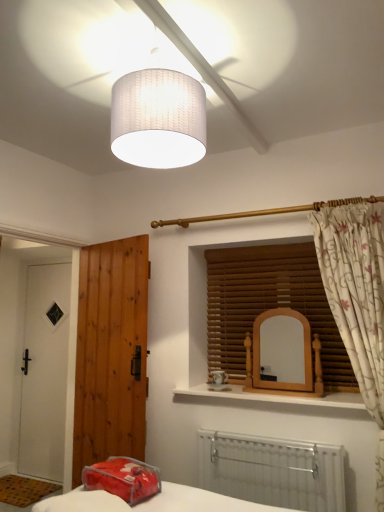
Locate an element on the screen. This screenshot has width=384, height=512. white metallic radiator at lower center is located at coordinates (272, 471).

What is the approximate height of wooden mirror at center?

wooden mirror at center is 21.90 inches in height.

In order to face translucent plastic pillow at lower center, should I rotate leftwards or rightwards?

Rotate left and turn 9.251 degrees.

Describe the element at coordinates (123, 478) in the screenshot. Image resolution: width=384 pixels, height=512 pixels. I see `translucent plastic pillow at lower center` at that location.

At what (x,y) coordinates should I click in order to perform the action: click on white matte door at left, which appears as the first door when viewed from the back. Please return your answer as a coordinate pair (x, y). Image resolution: width=384 pixels, height=512 pixels. Looking at the image, I should click on (45, 372).

Where is `white metallic radiator at lower center`? The image size is (384, 512). white metallic radiator at lower center is located at coordinates (272, 471).

How far apart are wooden blinds at center and wooden mirror at center?

10.05 inches.

Considering the relative sizes of wooden blinds at center and wooden mirror at center in the image provided, is wooden blinds at center thinner than wooden mirror at center?

Yes.

Is wooden blinds at center positioned beyond the bounds of wooden mirror at center?

Indeed, wooden blinds at center is completely outside wooden mirror at center.

Identify the location of medicine cabinet to the left of wooden blinds at center. (285, 354).

Are floral fabric curtain at right and wooden blinds at center far apart?

No.

Which of these two, floral fabric curtain at right or wooden blinds at center, stands taller?

floral fabric curtain at right.

From a real-world perspective, which object rests below the other?

From a 3D spatial view, floral fabric curtain at right is below.

How far apart are translucent plastic pillow at lower center and white matte door at left, marked as the 2th door in a front-to-back arrangement?

They are 6.94 feet apart.

From the image's perspective, between translucent plastic pillow at lower center and white matte door at left, which is the first door from left to right, who is located below?

white matte door at left, which is the first door from left to right, appears lower in the image.

Can you confirm if translucent plastic pillow at lower center is shorter than white matte door at left, marked as the 2th door in a front-to-back arrangement?

Correct, translucent plastic pillow at lower center is not as tall as white matte door at left, marked as the 2th door in a front-to-back arrangement.

Can you confirm if translucent plastic pillow at lower center is bigger than white matte door at left, which ranks as the second door in right-to-left order?

No, translucent plastic pillow at lower center is not bigger than white matte door at left, which ranks as the second door in right-to-left order.

Can you tell me how much floral fabric curtain at right and white metallic radiator at lower center differ in facing direction?

The angle between the facing direction of floral fabric curtain at right and the facing direction of white metallic radiator at lower center is 1.28 degrees.

Can you confirm if floral fabric curtain at right is wider than white metallic radiator at lower center?

Indeed, floral fabric curtain at right has a greater width compared to white metallic radiator at lower center.

Which of these two, floral fabric curtain at right or white metallic radiator at lower center, stands shorter?

With less height is white metallic radiator at lower center.

Considering the points (330, 215) and (277, 458), which point is in front, point (330, 215) or point (277, 458)?

The point (330, 215) is closer.

Does point (124, 457) come closer to viewer compared to point (260, 381)?

Yes.

Does translucent plastic pillow at lower center come behind wooden mirror at center?

No, it is not.

From the image's perspective, is translucent plastic pillow at lower center on top of wooden mirror at center?

Incorrect, from the image's perspective, translucent plastic pillow at lower center is lower than wooden mirror at center.

From the picture: Measure the distance between translucent plastic pillow at lower center and wooden mirror at center.

A distance of 1.16 meters exists between translucent plastic pillow at lower center and wooden mirror at center.

From a real-world perspective, is floral fabric curtain at right positioned above or below wooden mirror at center?

From a real-world perspective, floral fabric curtain at right is physically above wooden mirror at center.

Can you tell me how much floral fabric curtain at right and wooden mirror at center differ in facing direction?

There is a 2.55-degree angle between the facing directions of floral fabric curtain at right and wooden mirror at center.

Looking at this image, does floral fabric curtain at right turn towards wooden mirror at center?

No.

Considering the points (368, 264) and (268, 312), which point is in front, point (368, 264) or point (268, 312)?

The point (368, 264) is more forward.

Can you tell me how much white matte door at left, which appears as the first door when viewed from the back, and wooden mirror at center differ in facing direction?

There is a 1.69-degree angle between the facing directions of white matte door at left, which appears as the first door when viewed from the back, and wooden mirror at center.

From a real-world perspective, is white matte door at left, which is the first door from left to right, beneath wooden mirror at center?

Yes.

Can we say white matte door at left, which ranks as the second door in right-to-left order, lies outside wooden mirror at center?

Absolutely, white matte door at left, which ranks as the second door in right-to-left order, is external to wooden mirror at center.

In order to click on medicine cabinet on the left side of wooden blinds at center in this screenshot , I will do `click(285, 354)`.

You are a GUI agent. You are given a task and a screenshot of the screen. Output one action in this format:
    pyautogui.click(x=<x>, y=<y>)
    Task: Click on the curtain in front of the wooden blinds at center
    
    Given the screenshot: What is the action you would take?
    pyautogui.click(x=357, y=300)

From the image, which object appears to be farther from floral fabric curtain at right, wooden blinds at center or white textured lampshade at upper center?

Among the two, white textured lampshade at upper center is located further to floral fabric curtain at right.

Considering their positions, is white metallic radiator at lower center positioned further to floral fabric curtain at right than white matte door at left, which is the first door from left to right?

white matte door at left, which is the first door from left to right.

Looking at the image, which one is located closer to floral fabric curtain at right, white matte door at left, marked as the 2th door in a front-to-back arrangement, or wooden mirror at center?

The object closer to floral fabric curtain at right is wooden mirror at center.

When comparing their distances from translucent plastic pillow at lower center, does white metallic radiator at lower center or white matte door at left, which is the first door from left to right, seem further?

The object further to translucent plastic pillow at lower center is white matte door at left, which is the first door from left to right.

Based on their spatial positions, is brown wooden door at left, the 2th door positioned from the back, or translucent plastic pillow at lower center closer to white textured lampshade at upper center?

brown wooden door at left, the 2th door positioned from the back, is closer to white textured lampshade at upper center.

Estimate the real-world distances between objects in this image. Which object is further from wooden blinds at center, floral fabric curtain at right or brown wooden door at left, acting as the first door starting from the right?

brown wooden door at left, acting as the first door starting from the right, is further to wooden blinds at center.

Based on their spatial positions, is floral fabric curtain at right or white textured lampshade at upper center closer to wooden mirror at center?

floral fabric curtain at right lies closer to wooden mirror at center than the other object.

Considering their positions, is white textured lampshade at upper center positioned further to white metallic radiator at lower center than white matte door at left, which is the first door from left to right?

white textured lampshade at upper center is positioned further to the anchor white metallic radiator at lower center.

At what (x,y) coordinates should I click in order to perform the action: click on door between white matte door at left, which ranks as the second door in right-to-left order, and wooden mirror at center. Please return your answer as a coordinate pair (x, y). The width and height of the screenshot is (384, 512). Looking at the image, I should click on (111, 352).

Identify the location of curtain between white textured lampshade at upper center and wooden mirror at center from top to bottom. Image resolution: width=384 pixels, height=512 pixels. (357, 300).

Identify the location of window blind between white matte door at left, which appears as the first door when viewed from the back, and floral fabric curtain at right. (270, 305).

Locate an element on the screen. The width and height of the screenshot is (384, 512). radiator between translucent plastic pillow at lower center and wooden blinds at center in the front-back direction is located at coordinates (x=272, y=471).